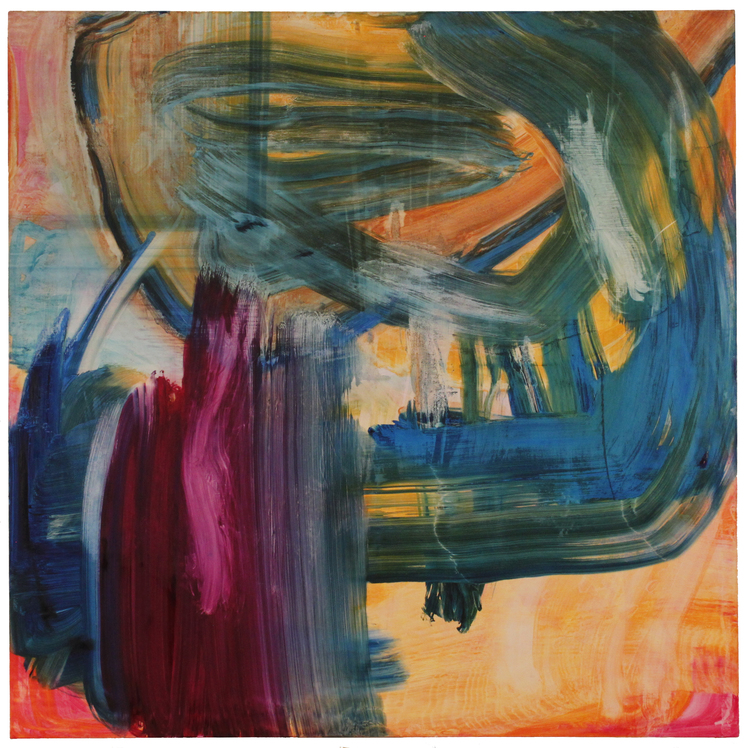
The height and width of the screenshot is (748, 750). Identify the location of 2 corners with red paint. (726, 729), (8, 723).